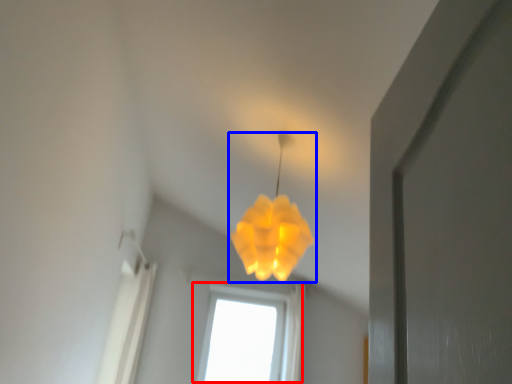
Question: Which point is closer to the camera, window (highlighted by a red box) or lamp (highlighted by a blue box)?

Choices:
 (A) window
 (B) lamp

Answer: (B)